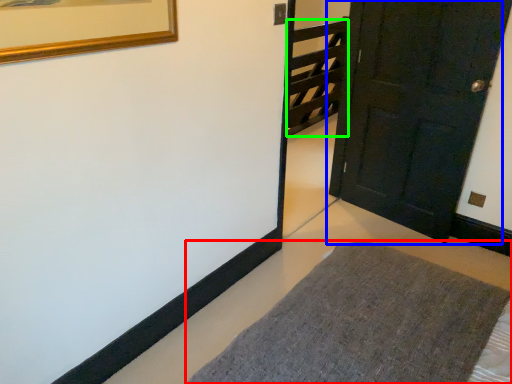
Question: Which object is the farthest from furniture (highlighted by a red box)? Choose among these: door (highlighted by a blue box) or stairwell (highlighted by a green box).

Choices:
 (A) door
 (B) stairwell

Answer: (B)